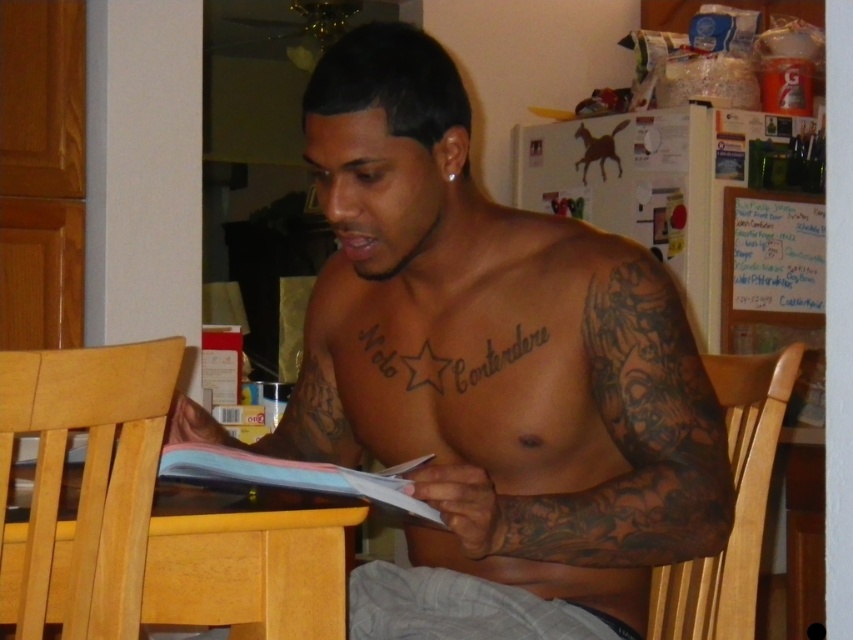
Question: Does dark skin tattooed torso at center appear on the right side of black tattooed arm at center?

Choices:
 (A) no
 (B) yes

Answer: (A)

Question: Does dark skin tattooed torso at center have a greater width compared to black tattooed arm at center?

Choices:
 (A) yes
 (B) no

Answer: (A)

Question: Which point is closer to the camera?

Choices:
 (A) black tattooed arm at center
 (B) light wood chair at lower right
 (C) light brown wood dining table at lower center
 (D) black ink tattoo at chest

Answer: (C)

Question: Which of the following is the closest to the observer?

Choices:
 (A) dark skin tattooed torso at center
 (B) black ink tattoo at chest

Answer: (A)

Question: Based on their relative distances, which object is nearer to the black ink tattoo at chest?

Choices:
 (A) light brown wood dining table at lower center
 (B) dark skin tattooed torso at center
 (C) light wood chair at lower right

Answer: (B)

Question: Can you confirm if dark skin tattooed torso at center is smaller than light brown wood dining table at lower center?

Choices:
 (A) no
 (B) yes

Answer: (A)